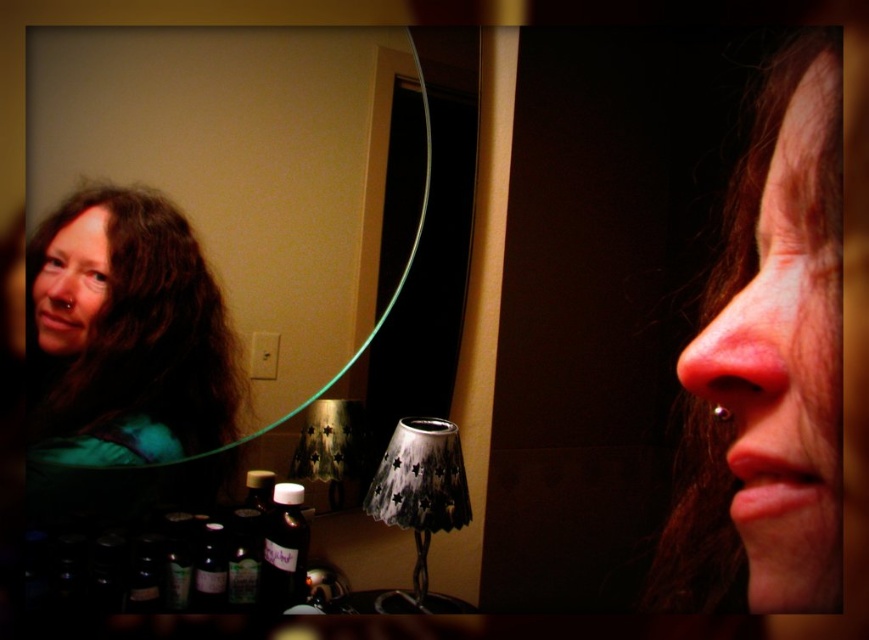
Question: Considering the real-world distances, which object is farthest from the dark brown silky hair at left?

Choices:
 (A) matte black face at upper left
 (B) pink skin at center
 (C) clear glass mirror at upper center
 (D) translucent dark bottle at lower center

Answer: (B)

Question: Which of the following is the farthest from the observer?

Choices:
 (A) clear glass mirror at upper center
 (B) translucent glass bottle at lower left
 (C) pink skin at center
 (D) translucent dark bottle at lower center

Answer: (D)

Question: Does clear glass mirror at upper center appear on the left side of translucent dark bottle at lower center?

Choices:
 (A) no
 (B) yes

Answer: (B)

Question: Is clear glass mirror at upper center further to camera compared to pink skin at center?

Choices:
 (A) no
 (B) yes

Answer: (B)

Question: Which point is farther to the camera?

Choices:
 (A) clear glass mirror at upper center
 (B) translucent glass bottle at lower left
 (C) dark brown silky hair at left
 (D) translucent dark bottle at lower center

Answer: (D)

Question: Does pink skin at center appear under matte black face at upper left?

Choices:
 (A) yes
 (B) no

Answer: (A)